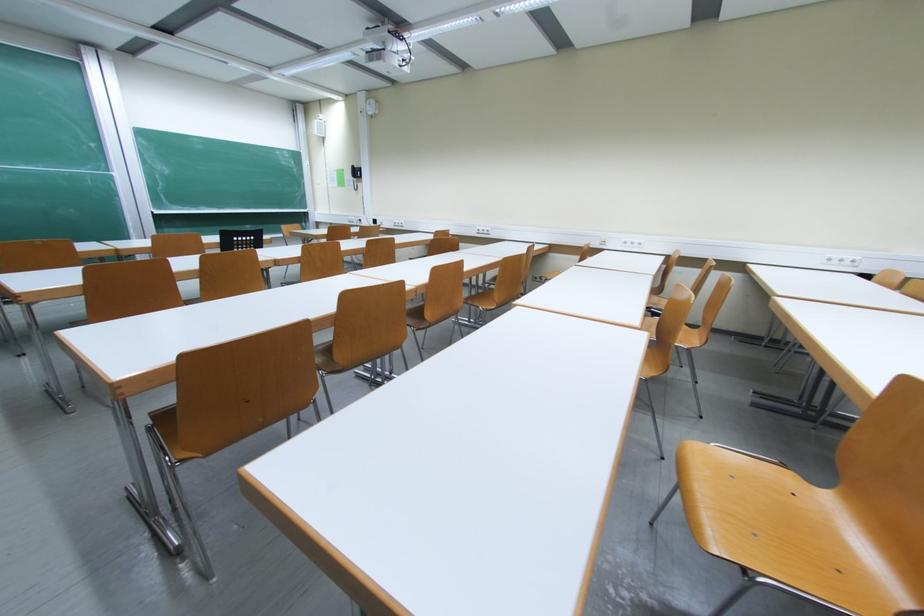
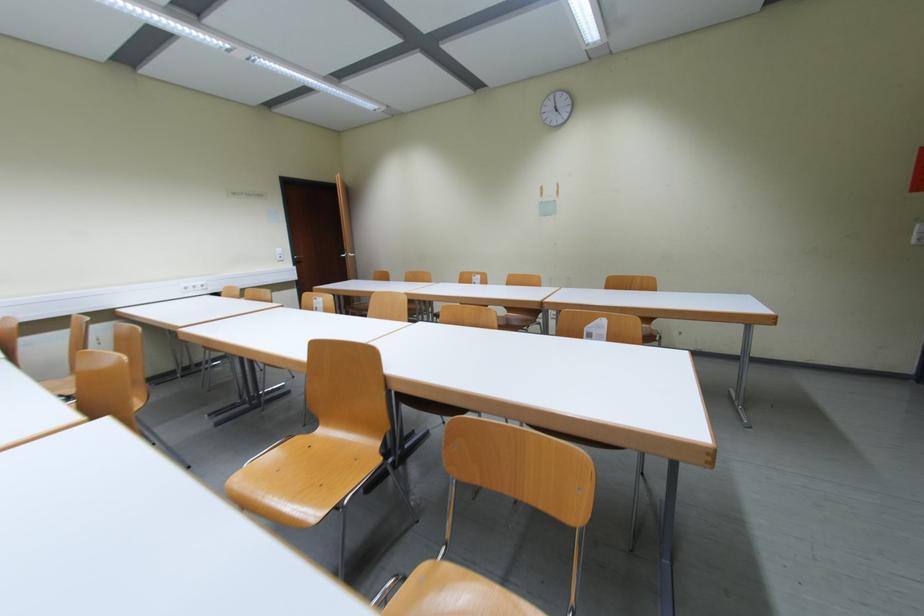
Question: The images are taken continuously from a first-person perspective. In which direction is your viewpoint rotating?

Choices:
 (A) Left
 (B) Right
 (C) Up
 (D) Down

Answer: (B)